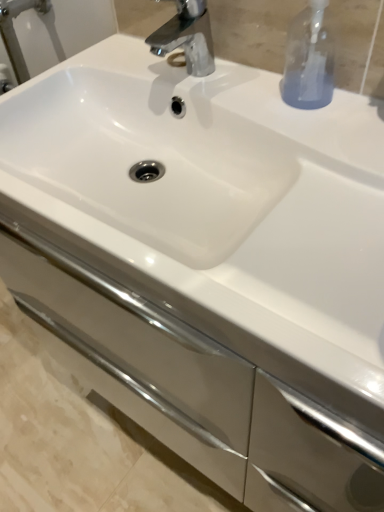
Question: Should I look upward or downward to see white glossy cabinet at center?

Choices:
 (A) up
 (B) down

Answer: (B)

Question: Is white glossy cabinet at center located outside polished chrome faucet at upper center?

Choices:
 (A) yes
 (B) no

Answer: (A)

Question: Does white glossy cabinet at center have a lesser height compared to polished chrome faucet at upper center?

Choices:
 (A) yes
 (B) no

Answer: (B)

Question: Does white glossy cabinet at center turn towards polished chrome faucet at upper center?

Choices:
 (A) yes
 (B) no

Answer: (B)

Question: Is white glossy cabinet at center directly adjacent to polished chrome faucet at upper center?

Choices:
 (A) yes
 (B) no

Answer: (B)

Question: From a real-world perspective, is white glossy cabinet at center positioned over polished chrome faucet at upper center based on gravity?

Choices:
 (A) yes
 (B) no

Answer: (B)

Question: From the image's perspective, does white glossy cabinet at center appear lower than polished chrome faucet at upper center?

Choices:
 (A) no
 (B) yes

Answer: (B)

Question: Does polished chrome faucet at upper center lie in front of transparent glass soap dispenser at upper right?

Choices:
 (A) no
 (B) yes

Answer: (A)

Question: Are polished chrome faucet at upper center and transparent glass soap dispenser at upper right beside each other?

Choices:
 (A) yes
 (B) no

Answer: (B)

Question: Are polished chrome faucet at upper center and transparent glass soap dispenser at upper right located far from each other?

Choices:
 (A) no
 (B) yes

Answer: (A)

Question: From the image's perspective, is polished chrome faucet at upper center on transparent glass soap dispenser at upper right?

Choices:
 (A) no
 (B) yes

Answer: (B)

Question: Does polished chrome faucet at upper center come behind transparent glass soap dispenser at upper right?

Choices:
 (A) no
 (B) yes

Answer: (B)

Question: Considering the relative sizes of polished chrome faucet at upper center and transparent glass soap dispenser at upper right in the image provided, is polished chrome faucet at upper center shorter than transparent glass soap dispenser at upper right?

Choices:
 (A) no
 (B) yes

Answer: (B)

Question: Can you confirm if polished chrome faucet at upper center is positioned to the right of white glossy cabinet at center?

Choices:
 (A) yes
 (B) no

Answer: (B)